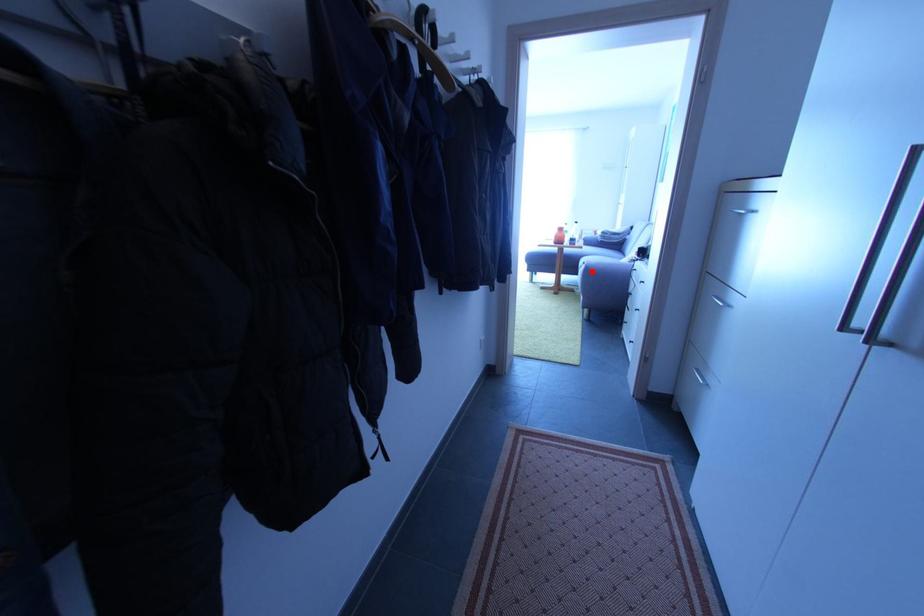
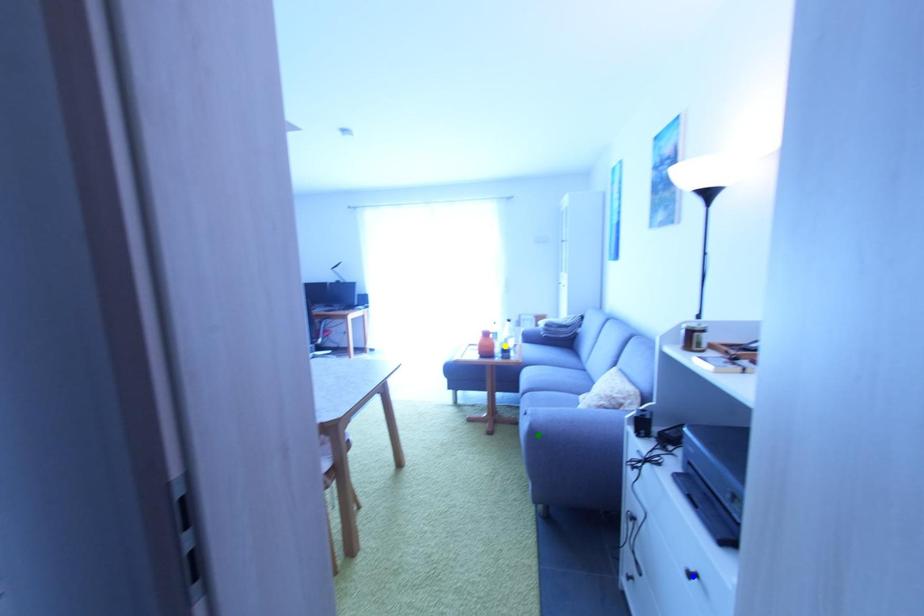
Question: I am providing you with two images of the same scene from different viewpoints. A red point is marked on the first image. You are given multiple points on the second image. Which spot in image 2 lines up with the point in image 1?

Choices:
 (A) yellow point
 (B) blue point
 (C) green point

Answer: (C)